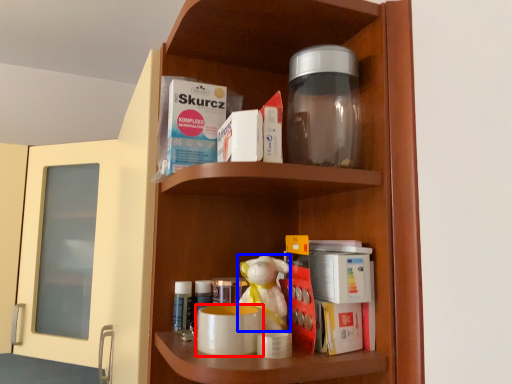
Question: Which object appears farthest to the camera in this image, mug (highlighted by a red box) or toy (highlighted by a blue box)?

Choices:
 (A) mug
 (B) toy

Answer: (B)